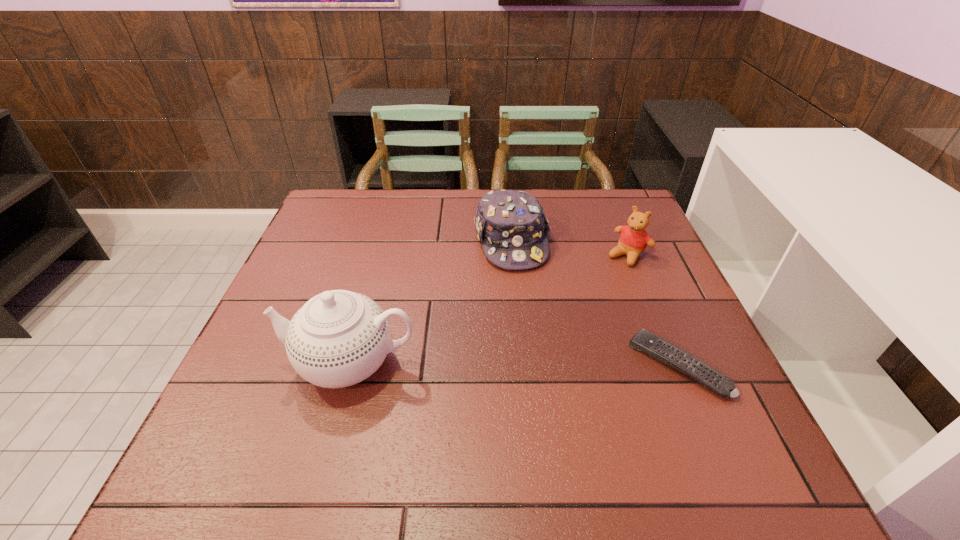
Locate an element on the screen. The width and height of the screenshot is (960, 540). object at the near right corner is located at coordinates (658, 348).

Image resolution: width=960 pixels, height=540 pixels. What are the coordinates of `vacant space at the far edge` in the screenshot? It's located at (575, 213).

Where is `free location at the near edge`? The height and width of the screenshot is (540, 960). free location at the near edge is located at coordinates click(x=416, y=431).

Where is `free space at the right edge of the desktop`? The width and height of the screenshot is (960, 540). free space at the right edge of the desktop is located at coordinates [x=623, y=278].

Image resolution: width=960 pixels, height=540 pixels. In the image, there is a desktop. Find the location of `vacant space at the far left corner`. vacant space at the far left corner is located at coordinates (362, 227).

You are a GUI agent. You are given a task and a screenshot of the screen. Output one action in this format:
    pyautogui.click(x=<x>, y=<y>)
    Task: Click on the vacant point at the far right corner
    This screenshot has width=960, height=540.
    Given the screenshot: What is the action you would take?
    pyautogui.click(x=629, y=194)

Locate an element on the screen. empty space that is in between the headwear and the remote control is located at coordinates (594, 303).

This screenshot has width=960, height=540. Identify the location of free area in between the tallest object and the teddy bear. (490, 309).

Identify the location of empty space between the remote control and the teddy bear. This screenshot has width=960, height=540. (653, 310).

Locate an element on the screen. Image resolution: width=960 pixels, height=540 pixels. empty location between the remote control and the headwear is located at coordinates (594, 303).